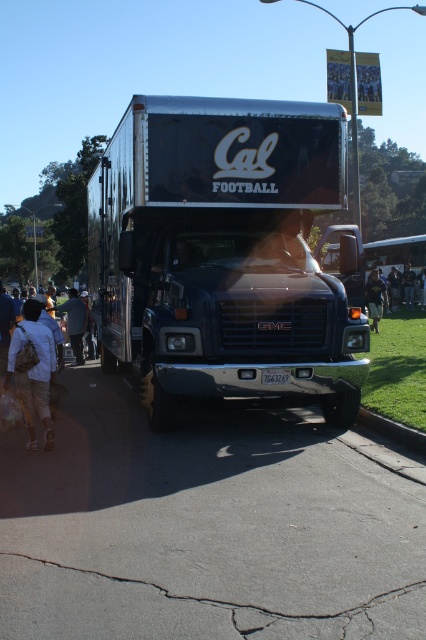
Question: Can you confirm if dark gray fabric jacket at left is bigger than dark blue shirt at center?

Choices:
 (A) no
 (B) yes

Answer: (B)

Question: Estimate the real-world distances between objects in this image. Which object is farther from the dark gray fabric jacket at left?

Choices:
 (A) light brown backpack at left
 (B) shiny black truck at center
 (C) dark blue shirt at center
 (D) dark blue uniform at lower right

Answer: (C)

Question: Which object appears closest to the camera in this image?

Choices:
 (A) shiny black truck at center
 (B) dark gray fabric jacket at left
 (C) gray concrete curb at lower right
 (D) dark blue shirt at center

Answer: (C)

Question: Does shiny black truck at center appear under gray concrete curb at lower right?

Choices:
 (A) yes
 (B) no

Answer: (B)

Question: Which point is farther to the camera?

Choices:
 (A) click(83, 326)
 (B) click(405, 435)

Answer: (A)

Question: Is shiny black truck at center to the left of dark gray fabric jacket at left from the viewer's perspective?

Choices:
 (A) yes
 (B) no

Answer: (B)